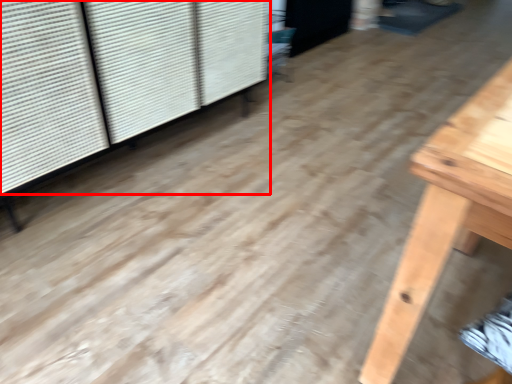
Question: Where is shutter (annotated by the red box) located in relation to screen door in the image?

Choices:
 (A) right
 (B) left

Answer: (B)